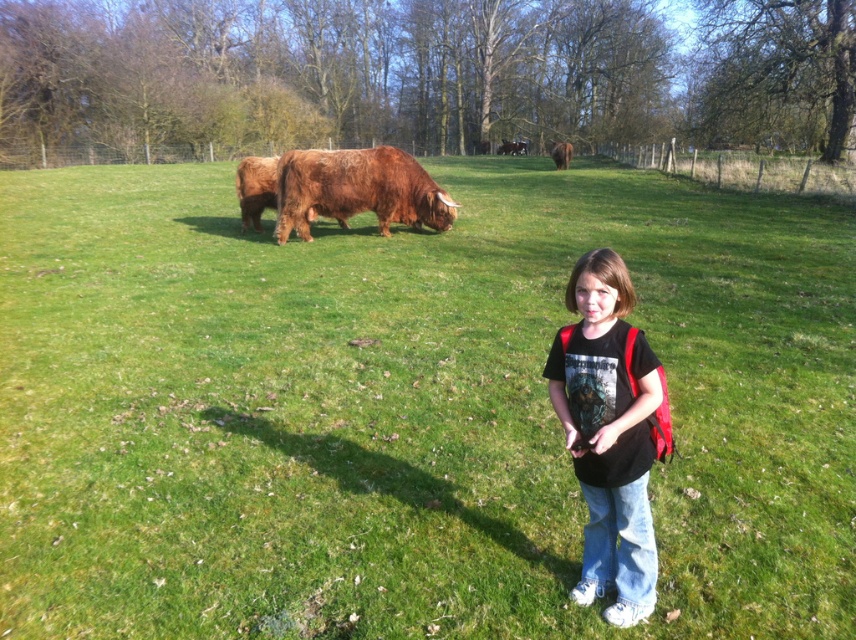
Question: Which of the following is the farthest from the observer?

Choices:
 (A) (642, 417)
 (B) (247, 202)
 (C) (557, 156)

Answer: (C)

Question: Does black matte shirt at center appear on the left side of brown furry yak at center?

Choices:
 (A) yes
 (B) no

Answer: (B)

Question: Does black matte shirt at center have a larger size compared to brown furry yak at center?

Choices:
 (A) no
 (B) yes

Answer: (A)

Question: Does brown fuzzy yak at center have a smaller size compared to brown fuzzy yak at upper center?

Choices:
 (A) yes
 (B) no

Answer: (A)

Question: Which of the following is the farthest from the observer?

Choices:
 (A) (372, 204)
 (B) (551, 394)
 (C) (563, 161)

Answer: (C)

Question: Which of these objects is positioned closest to the black matte shirt at center?

Choices:
 (A) brown fuzzy yak at upper center
 (B) brown furry yak at center
 (C) brown fuzzy yak at center

Answer: (B)